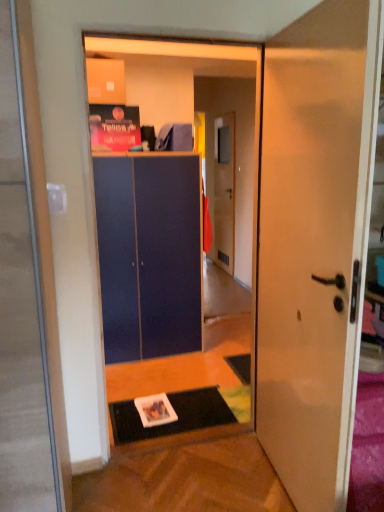
This screenshot has width=384, height=512. In order to click on blank space situated above black rubber doormat at lower center (from a real-world perspective) in this screenshot , I will do pyautogui.click(x=169, y=408).